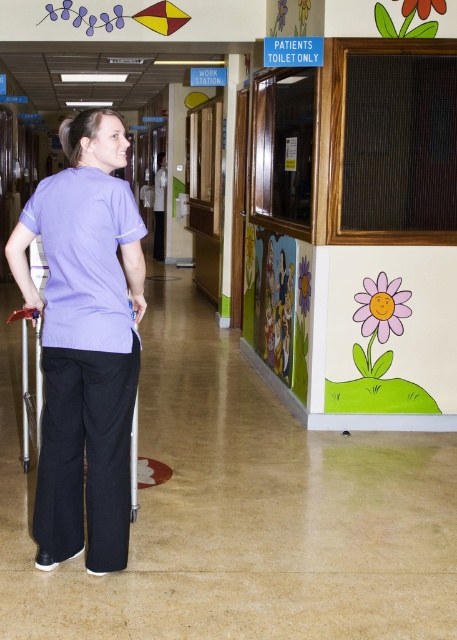
You are a healthcare worker in a hospital hallway. You need to reach a patient wearing a matte purple shirt at center before the matte plastic walker at center can be used to move them. Can you reach the patient before the walker if you both start moving towards each other at the same time, assuming you walk at 1.5 meters per second and the walker moves at 0.8 meters per second?

The distance between the matte purple shirt at center and the matte plastic walker at center is 13.81 meters. If you move towards each other at 1.5 mps and the walker at 0.8 mps, your combined speed is 2.3 mps. The time to meet would be 13.81 divided by 2.3, which is approximately 6 seconds. Since you are moving faster, you will reach the patient before the walker does.

You are a nurse in the hallway and need to quickly assess the space. Which object, the matte purple shirt at center or the matte plastic walker at center, takes up more visual space in the scene?

The matte purple shirt at center is larger in size than the matte plastic walker at center, so the matte purple shirt at center takes up more visual space in the scene.